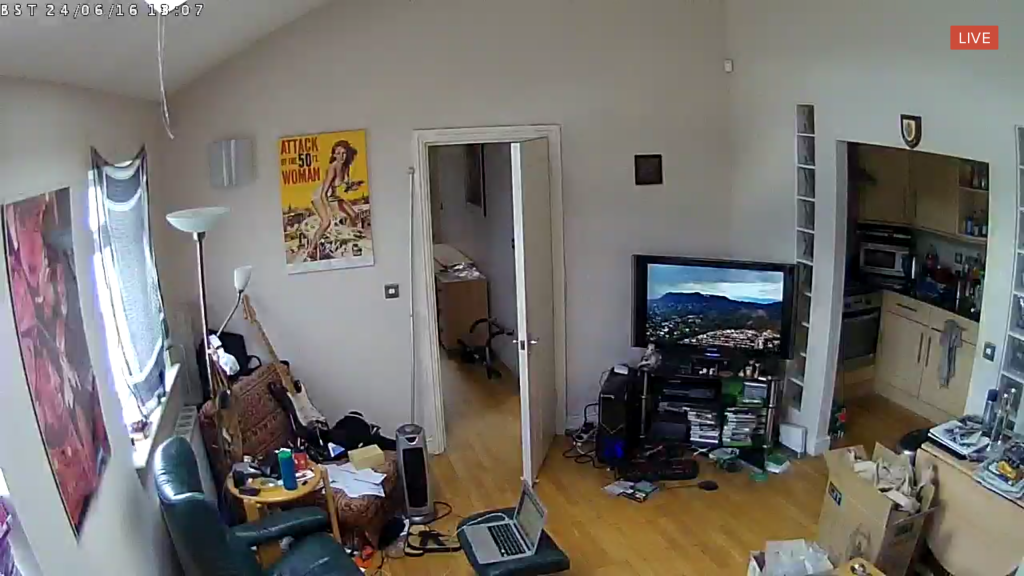
Find the location of a particular element. The width and height of the screenshot is (1024, 576). open door is located at coordinates (527, 282).